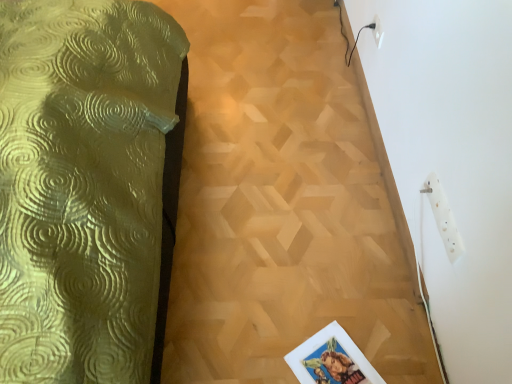
Question: Is white plastic socket at upper right, acting as the 2th electric outlet starting from the top, thinner than white plastic electric outlet at upper right, the second electric outlet in the right-to-left sequence?

Choices:
 (A) no
 (B) yes

Answer: (A)

Question: From the image's perspective, is white plastic socket at upper right, the 1th electric outlet in the front-to-back sequence, on white plastic electric outlet at upper right, which appears as the 1th electric outlet when viewed from the left?

Choices:
 (A) yes
 (B) no

Answer: (B)

Question: From the image's perspective, would you say white plastic socket at upper right, the 1th electric outlet in the bottom-to-top sequence, is shown under white plastic electric outlet at upper right, which appears as the 1th electric outlet when viewed from the left?

Choices:
 (A) yes
 (B) no

Answer: (A)

Question: Considering the relative positions of white plastic socket at upper right, acting as the 2th electric outlet starting from the top, and white plastic electric outlet at upper right, which is the first electric outlet in back-to-front order, in the image provided, is white plastic socket at upper right, acting as the 2th electric outlet starting from the top, to the left of white plastic electric outlet at upper right, which is the first electric outlet in back-to-front order, from the viewer's perspective?

Choices:
 (A) yes
 (B) no

Answer: (B)

Question: Could you tell me if white plastic socket at upper right, placed as the first electric outlet when sorted from right to left, is facing white plastic electric outlet at upper right, the second electric outlet in the right-to-left sequence?

Choices:
 (A) yes
 (B) no

Answer: (B)

Question: Is white plastic electric outlet at upper right, the second electric outlet in the right-to-left sequence, inside the boundaries of wooden parquet floor at center, or outside?

Choices:
 (A) inside
 (B) outside

Answer: (B)

Question: Is white plastic electric outlet at upper right, which appears as the 1th electric outlet when viewed from the left, bigger or smaller than wooden parquet floor at center?

Choices:
 (A) big
 (B) small

Answer: (B)

Question: Is white plastic electric outlet at upper right, the second electric outlet in the right-to-left sequence, wider or thinner than wooden parquet floor at center?

Choices:
 (A) thin
 (B) wide

Answer: (A)

Question: From a real-world perspective, relative to wooden parquet floor at center, is white plastic electric outlet at upper right, the second electric outlet in the right-to-left sequence, vertically above or below?

Choices:
 (A) above
 (B) below

Answer: (A)

Question: Would you say white plastic socket at upper right, the 1th electric outlet in the bottom-to-top sequence, is inside or outside wooden parquet floor at center?

Choices:
 (A) inside
 (B) outside

Answer: (B)

Question: In the image, is white plastic socket at upper right, the 1th electric outlet in the bottom-to-top sequence, on the left side or the right side of wooden parquet floor at center?

Choices:
 (A) right
 (B) left

Answer: (A)

Question: Looking at their shapes, would you say white plastic socket at upper right, acting as the 2th electric outlet starting from the top, is wider or thinner than wooden parquet floor at center?

Choices:
 (A) wide
 (B) thin

Answer: (B)

Question: Considering their positions, is white plastic socket at upper right, acting as the 2th electric outlet starting from the top, located in front of or behind wooden parquet floor at center?

Choices:
 (A) behind
 (B) front

Answer: (B)

Question: Is wooden parquet floor at center to the left or to the right of white plastic socket at upper right, placed as the second electric outlet when sorted from left to right, in the image?

Choices:
 (A) right
 (B) left

Answer: (B)

Question: Is wooden parquet floor at center bigger or smaller than white plastic socket at upper right, the 1th electric outlet in the bottom-to-top sequence?

Choices:
 (A) small
 (B) big

Answer: (B)